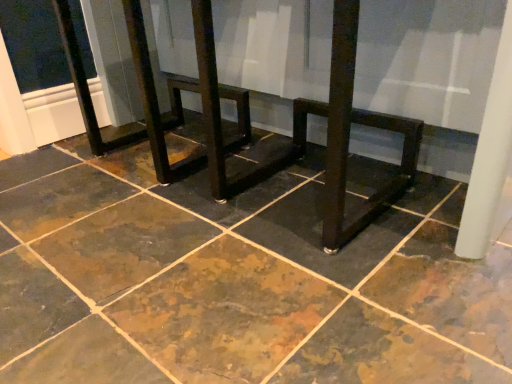
Where is `vacant area to the right of matte dark wood table at center`? The image size is (512, 384). vacant area to the right of matte dark wood table at center is located at coordinates (426, 201).